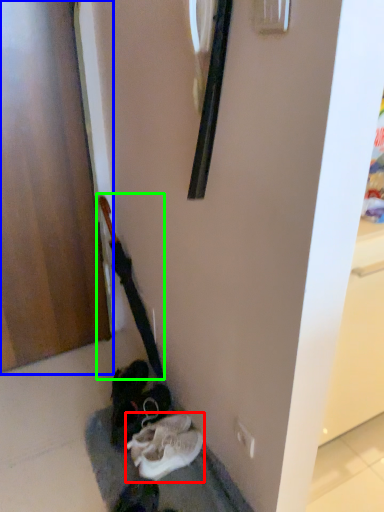
Question: Considering the real-world distances, which object is closest to footwear (highlighted by a red box)? door (highlighted by a blue box) or guitar (highlighted by a green box).

Choices:
 (A) door
 (B) guitar

Answer: (B)